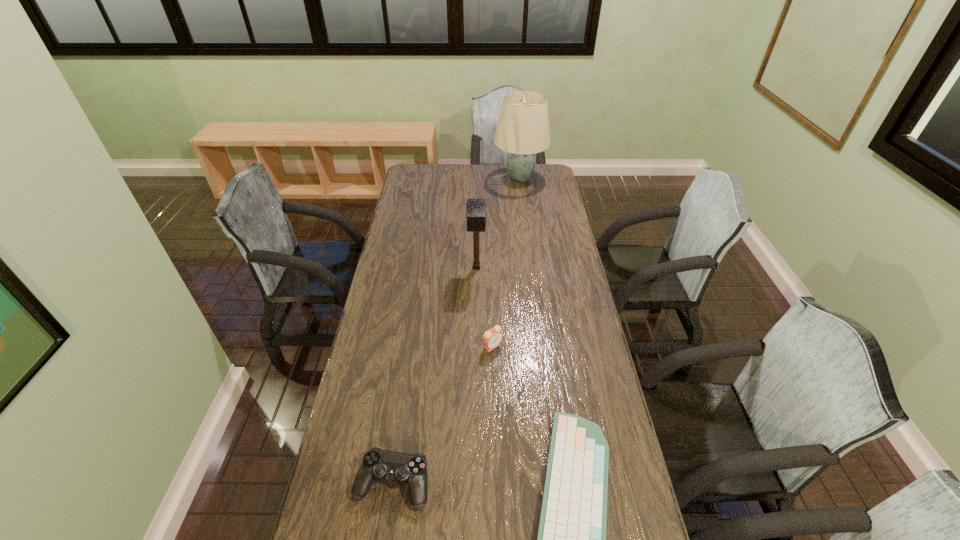
Find the location of a particular element. The height and width of the screenshot is (540, 960). object that is at the far edge is located at coordinates (523, 130).

What are the coordinates of `object that is at the left edge` in the screenshot? It's located at (379, 465).

Find the location of a particular element. object positioned at the right edge is located at coordinates (523, 130).

Locate an element on the screen. This screenshot has width=960, height=540. object that is at the far right corner is located at coordinates (523, 130).

This screenshot has height=540, width=960. I want to click on free space at the far edge of the desktop, so click(450, 165).

Locate an element on the screen. This screenshot has width=960, height=540. vacant space at the left edge of the desktop is located at coordinates (405, 276).

Locate an element on the screen. vacant region at the right edge of the desktop is located at coordinates (586, 380).

The width and height of the screenshot is (960, 540). In the image, there is a desktop. Find the location of `free space at the far left corner`. free space at the far left corner is located at coordinates (429, 174).

Find the location of a particular element. vacant space that is in between the third farthest object and the lampshade is located at coordinates (506, 262).

You are a GUI agent. You are given a task and a screenshot of the screen. Output one action in this format:
    pyautogui.click(x=<x>, y=<y>)
    Task: Click on the vacant area that lies between the farthest object and the mallet
    The height and width of the screenshot is (540, 960).
    Given the screenshot: What is the action you would take?
    click(498, 223)